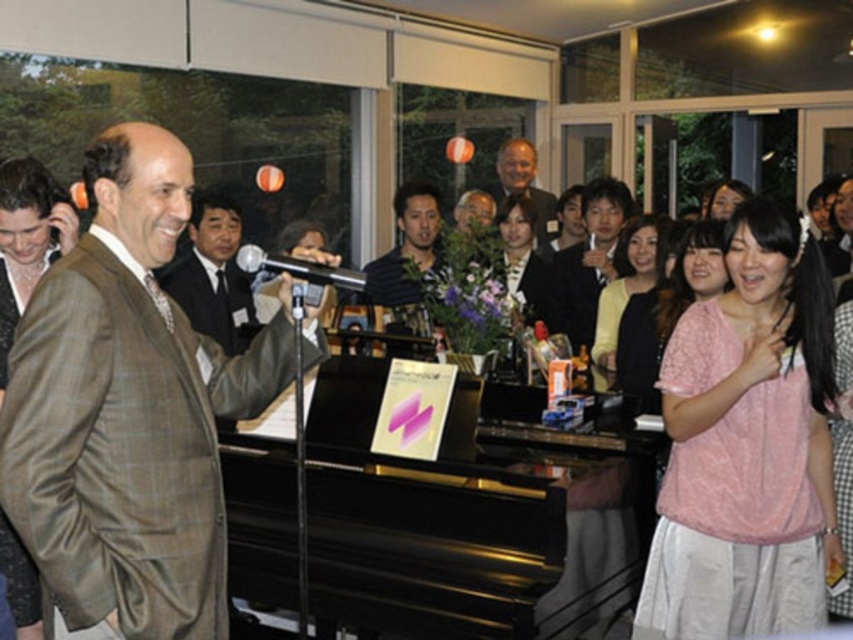
Question: Does brown checkered suit at left appear on the left side of matte black hair at center?

Choices:
 (A) yes
 (B) no

Answer: (A)

Question: Which point is farther from the camera taking this photo?

Choices:
 (A) (337, 285)
 (B) (369, 266)

Answer: (B)

Question: Does black shirt at center have a smaller size compared to pink fabric shirt at upper right?

Choices:
 (A) no
 (B) yes

Answer: (B)

Question: Does dark brown suit at center have a larger size compared to matte black hair at center?

Choices:
 (A) no
 (B) yes

Answer: (B)

Question: Which of these objects is positioned closest to the matte brown jacket at left?

Choices:
 (A) light brown suit at center
 (B) light brown hair at center
 (C) pink textured blouse at lower right

Answer: (C)

Question: Which object is the farthest from the dark brown suit at center?

Choices:
 (A) pink lace blouse at center
 (B) pink fabric shirt at center
 (C) pink fabric shirt at upper right

Answer: (C)